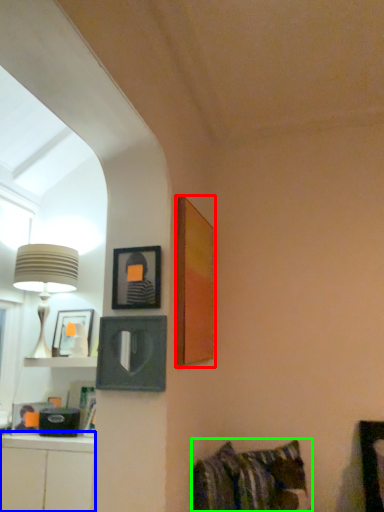
Question: Which is farther away from picture frame (highlighted by a red box)? cabinetry (highlighted by a blue box) or bed (highlighted by a green box)?

Choices:
 (A) cabinetry
 (B) bed

Answer: (A)